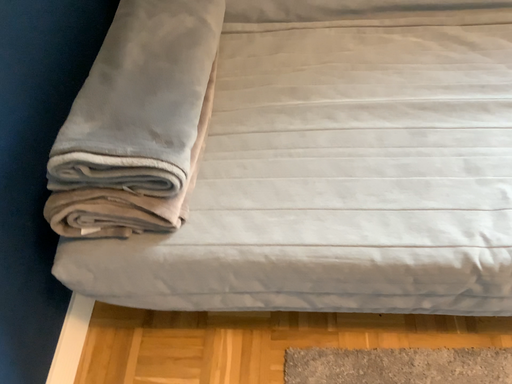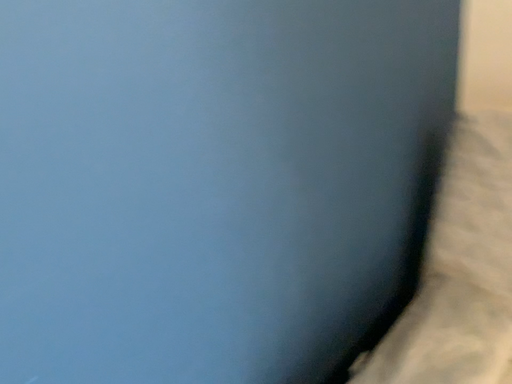
Question: Which way did the camera rotate in the video?

Choices:
 (A) rotated left
 (B) rotated right

Answer: (A)